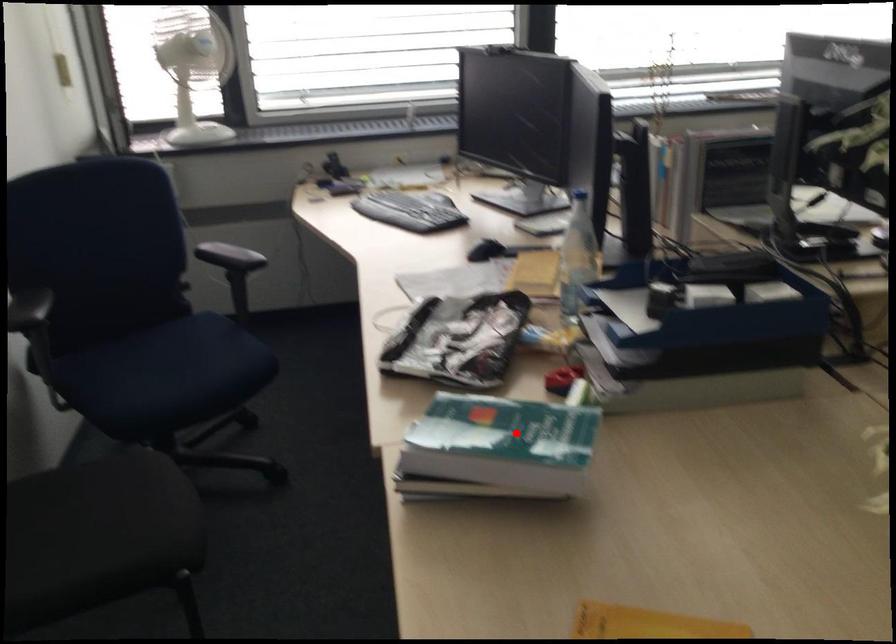
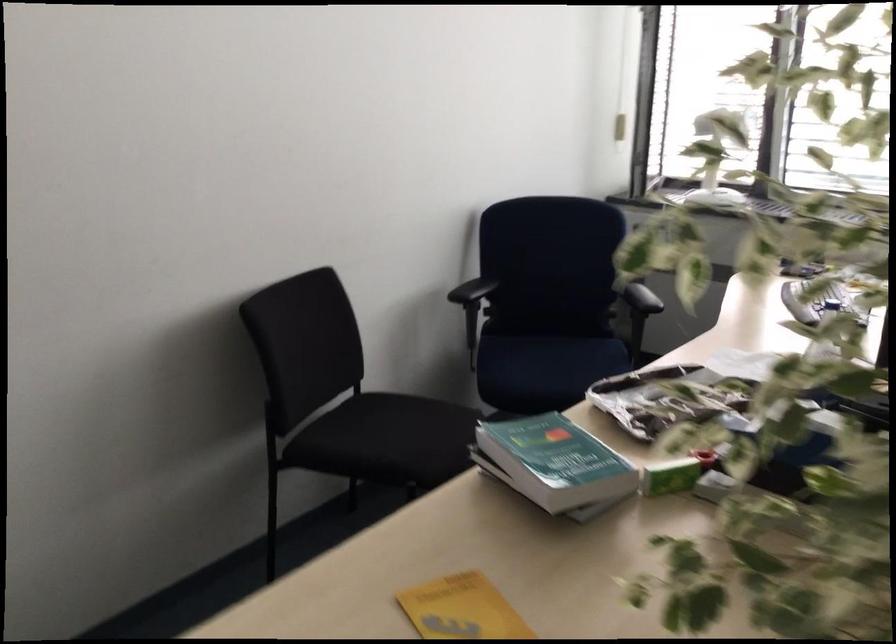
Question: I am providing you with two images of the same scene from different viewpoints. Given a red point in image1, look at the same physical point in image2. Is it:

Choices:
 (A) Closer to the viewpoint
 (B) Farther from the viewpoint

Answer: (B)